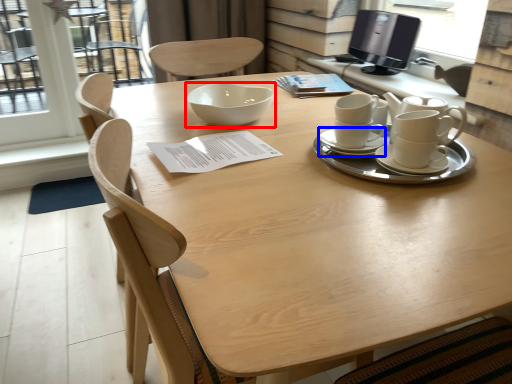
Question: Which object is further to the camera taking this photo, bowl (highlighted by a red box) or saucer (highlighted by a blue box)?

Choices:
 (A) bowl
 (B) saucer

Answer: (A)